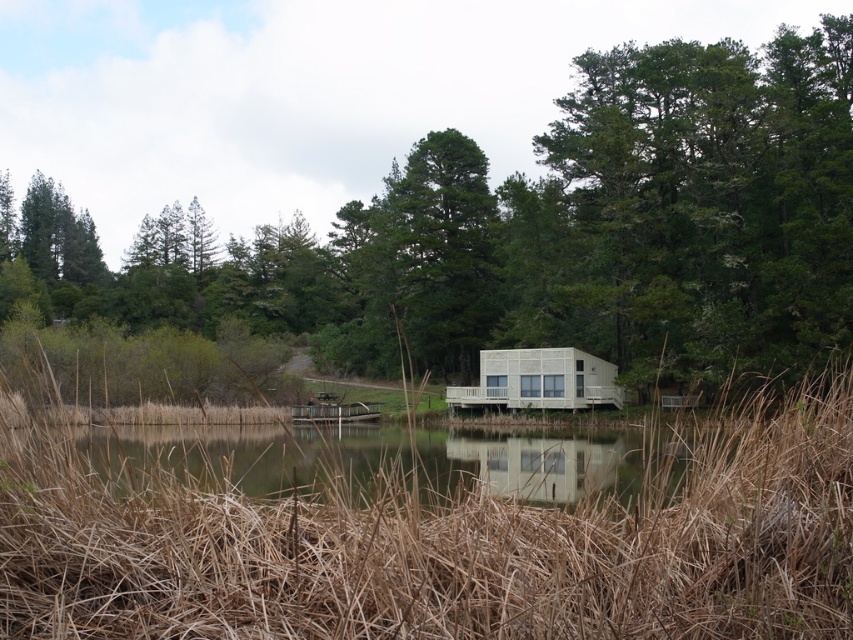
Consider the image. You are standing at the point marked as point (705, 90) in the lakeside scene. You want to walk straight towards the dense patch of dry, golden brown reeds in the foreground. Will you be able to see the white modern style house on stilts beyond the reeds as you walk?

The point marked as point (705, 90) is 190.37 feet away from the viewer. Since the dense patch of dry, golden brown reeds partially obscures the view of the lake and the house beyond, walking straight towards the reeds may block your view of the white modern style house on stilts. However, the exact visibility depends on the reeds density and your proximity, but based on the given information, the reeds might obstruct the view.

You are a photographer planning to capture the reflection of the green leafy tree at center and the clear water at center in the lake. Based on the scene, which object should appear to the left in your photo?

The green leafy tree at center is positioned on the left side of clear water at center, so in the photo, the green leafy tree at center should appear to the left of the clear water at center.

You are a photographer planning to capture the green leafy tree at center and the clear water at center in a single shot. Considering their relative sizes, which object should you focus on first to ensure both are in frame?

The green leafy tree at center has a greater height compared to clear water at center, so you should focus on the green leafy tree at center first to ensure both are in frame.